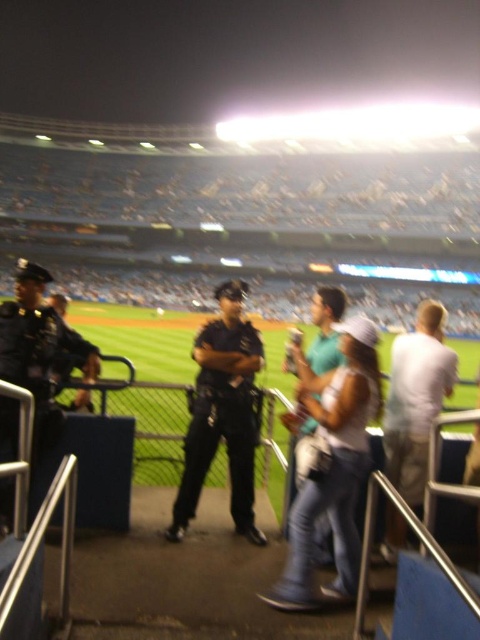
Question: Which object is positioned closest to the teal fabric shirt at center?

Choices:
 (A) white cotton shirt at right
 (B) dark blue uniform at center

Answer: (B)

Question: Can you confirm if dark blue uniform at center is positioned below white cotton shirt at right?

Choices:
 (A) no
 (B) yes

Answer: (A)

Question: Does dark blue uniform at left appear over white cotton shirt at right?

Choices:
 (A) no
 (B) yes

Answer: (B)

Question: Which point appears closest to the camera in this image?

Choices:
 (A) (222, 376)
 (B) (414, 380)
 (C) (324, 365)
 (D) (13, 417)

Answer: (D)

Question: Which point is farther to the camera?

Choices:
 (A) dark blue uniform at center
 (B) teal fabric shirt at center
 (C) white cotton shirt at right

Answer: (A)

Question: Does dark blue uniform at left appear under teal fabric shirt at center?

Choices:
 (A) no
 (B) yes

Answer: (B)